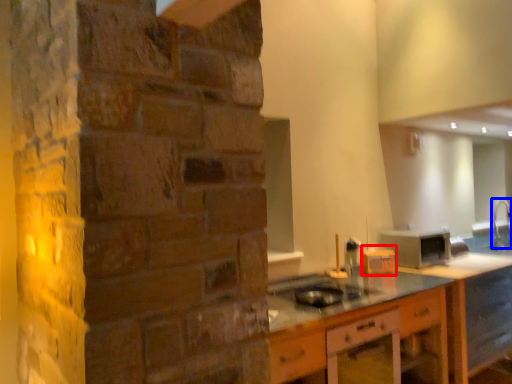
Question: Which point is closer to the camera, appliance (highlighted by a red box) or faucet (highlighted by a blue box)?

Choices:
 (A) appliance
 (B) faucet

Answer: (A)